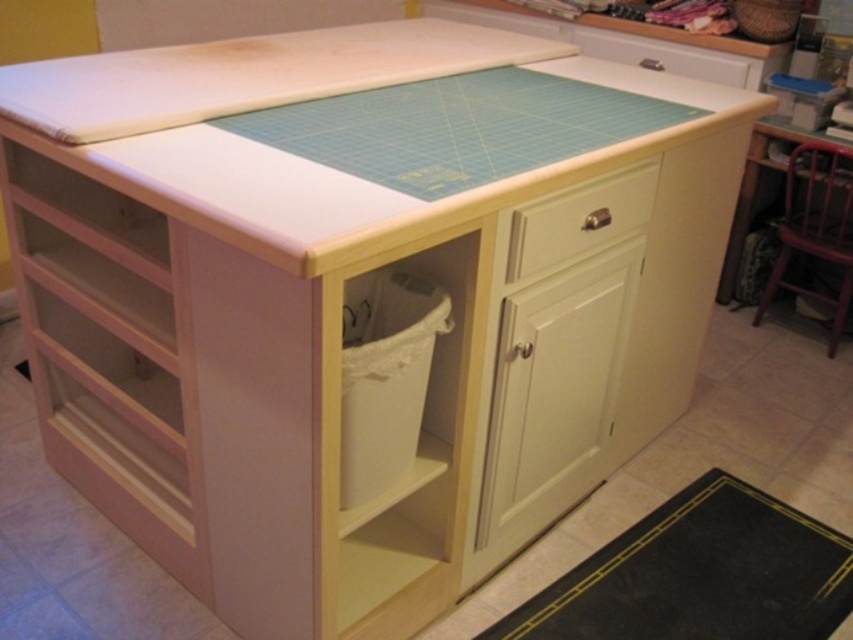
You are standing at the center of the room and want to sit down. There is a wooden chair at right located at point (816,225). Is the wooden chair at right within a 2 meter radius from your current position?

The wooden chair at right is located at point (816,225). To determine if it is within a 2 meter radius, we need to know the room dimensions or the coordinate system scale. Since this information is not provided in the scene description, we cannot accurately calculate the distance. Please provide additional details about the room size or coordinate system to proceed.

You are standing at the center of the room and want to sit down. Which direction should you move to reach the wooden chair at right?

The wooden chair at right is located at the right side of the room, so you should move to your right to reach it.

You are sitting on the wooden chair at right and want to reach the white wood drawer at right. Can you easily access it from your current position?

The wooden chair at right is positioned over the white wood drawer at right, so you cannot easily access the white wood drawer at right from your current position.